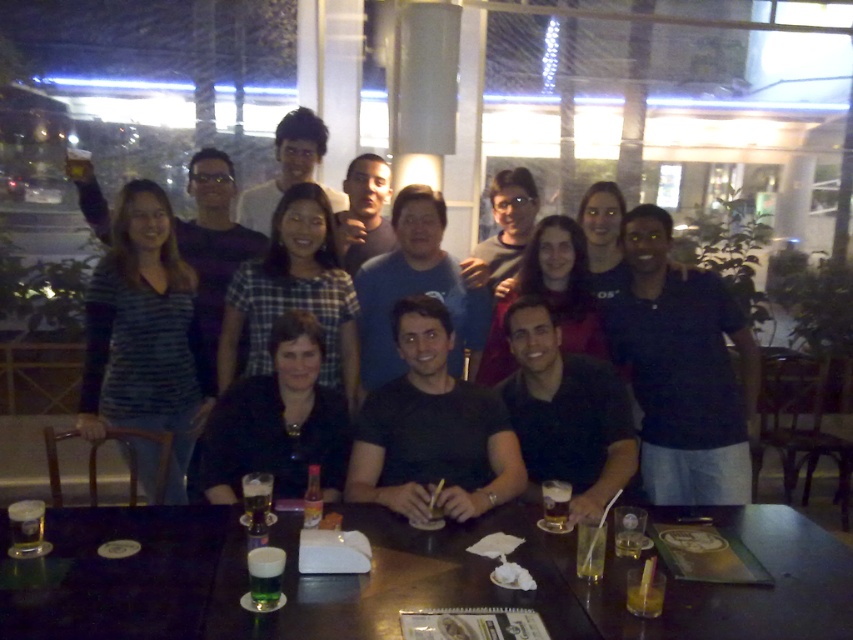
Question: Which of the following is the closest to the observer?

Choices:
 (A) (577, 572)
 (B) (618, 538)
 (C) (656, 580)

Answer: (C)

Question: Among these objects, which one is farthest from the camera?

Choices:
 (A) blue t-shirt at center
 (B) black matte shirt at center
 (C) striped fabric shirt at left

Answer: (A)

Question: Which is farther from the translucent glass beer at table center?

Choices:
 (A) translucent glass drink at table center
 (B) black matte shirt at center

Answer: (B)

Question: Can you confirm if striped fabric shirt at left is positioned below plaid fabric shirt at center?

Choices:
 (A) yes
 (B) no

Answer: (A)

Question: Is shiny dark wood table at center wider than smooth black shirt at center?

Choices:
 (A) yes
 (B) no

Answer: (A)

Question: Where is shiny dark wood table at center located in relation to blue t-shirt at center in the image?

Choices:
 (A) above
 (B) below

Answer: (B)